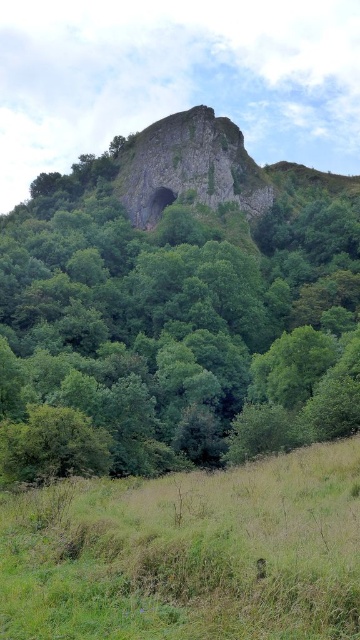
Based on the photo, you are a hiker trying to decide where to set up your tent. You have two options in the image provided. The first option is the green grassy field at lower center, and the second is the rusty stone rock at center. Considering the size of these areas, which location would provide more space for your tent and equipment?

The rusty stone rock at center is larger in size compared to the green grassy field at lower center, so it would provide more space for your tent and equipment.

You are a hiker trying to reach the cave entrance at the base of the rusty stone rock at center. There is a green leafy tree at center blocking your path. Can you walk around it to reach the rock?

The green leafy tree at center is much taller than the rusty stone rock at center, so it might cast a shadow or block the path, but you can walk around it to reach the rock.